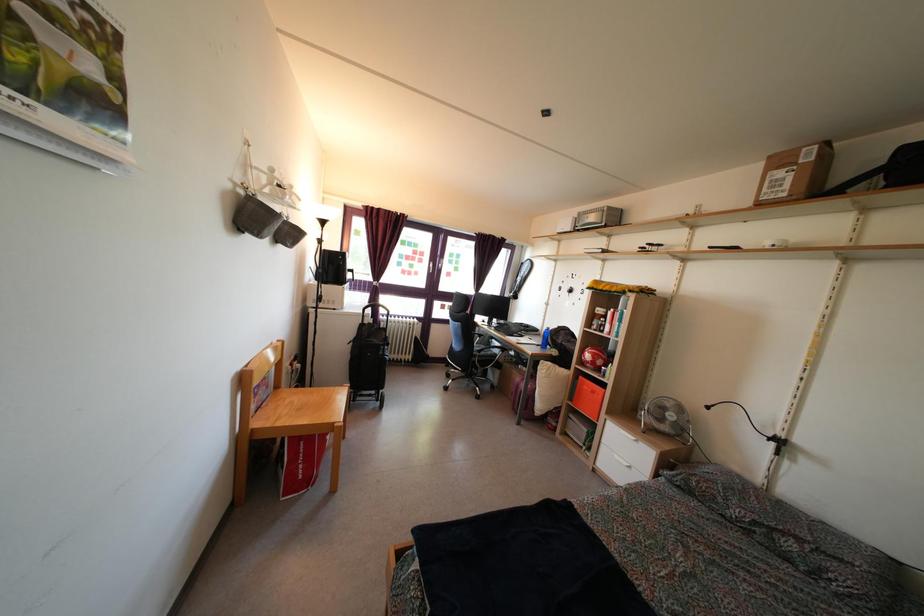
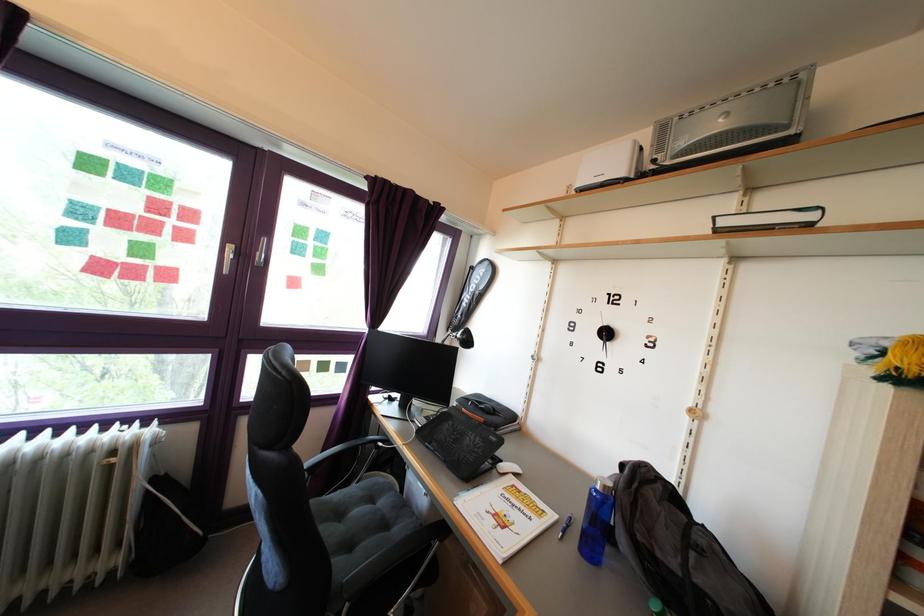
Question: In a continuous first-person perspective shot, in which direction is the camera moving?

Choices:
 (A) Left
 (B) Right
 (C) Forward
 (D) Backward

Answer: (C)